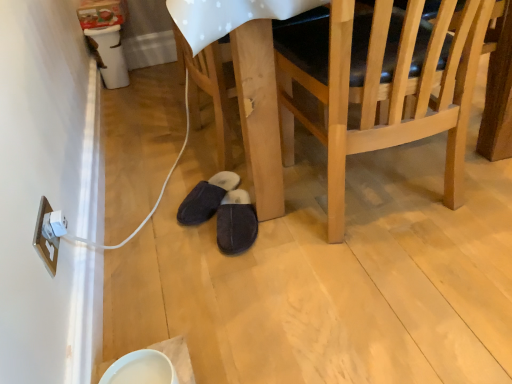
Question: Considering the relative sizes of black suede slippers at lower center, the 2th footwear positioned from the right, and white plastic electric outlet at lower left in the image provided, is black suede slippers at lower center, the 2th footwear positioned from the right, taller than white plastic electric outlet at lower left?

Choices:
 (A) yes
 (B) no

Answer: (B)

Question: From the image's perspective, is black suede slippers at lower center, the first footwear viewed from the left, under white plastic electric outlet at lower left?

Choices:
 (A) no
 (B) yes

Answer: (A)

Question: Is the depth of black suede slippers at lower center, the 2th footwear positioned from the right, greater than that of white plastic electric outlet at lower left?

Choices:
 (A) yes
 (B) no

Answer: (A)

Question: From a real-world perspective, is black suede slippers at lower center, the 2th footwear positioned from the right, on white plastic electric outlet at lower left?

Choices:
 (A) no
 (B) yes

Answer: (A)

Question: From the image's perspective, is black suede slippers at lower center, the 2th footwear positioned from the right, above white plastic electric outlet at lower left?

Choices:
 (A) yes
 (B) no

Answer: (A)

Question: Does black suede slippers at lower center, the first footwear viewed from the left, lie in front of white plastic electric outlet at lower left?

Choices:
 (A) no
 (B) yes

Answer: (A)

Question: Is dark gray suede slippers at lower center, placed as the 2th footwear when sorted from left to right, turned away from white plastic electric outlet at lower left?

Choices:
 (A) no
 (B) yes

Answer: (A)

Question: Does dark gray suede slippers at lower center, the 1th footwear from the right, have a larger size compared to white plastic electric outlet at lower left?

Choices:
 (A) yes
 (B) no

Answer: (A)

Question: Can you confirm if dark gray suede slippers at lower center, the 1th footwear from the right, is positioned to the left of white plastic electric outlet at lower left?

Choices:
 (A) no
 (B) yes

Answer: (A)

Question: Considering the relative sizes of dark gray suede slippers at lower center, placed as the 2th footwear when sorted from left to right, and white plastic electric outlet at lower left in the image provided, is dark gray suede slippers at lower center, placed as the 2th footwear when sorted from left to right, wider than white plastic electric outlet at lower left?

Choices:
 (A) no
 (B) yes

Answer: (B)

Question: Considering the relative positions of dark gray suede slippers at lower center, the 1th footwear from the right, and white plastic electric outlet at lower left in the image provided, is dark gray suede slippers at lower center, the 1th footwear from the right, in front of white plastic electric outlet at lower left?

Choices:
 (A) no
 (B) yes

Answer: (A)

Question: Is dark gray suede slippers at lower center, the 1th footwear from the right, thinner than white plastic electric outlet at lower left?

Choices:
 (A) no
 (B) yes

Answer: (A)

Question: Is white plastic electric outlet at lower left wider than light wood chair at center?

Choices:
 (A) no
 (B) yes

Answer: (A)